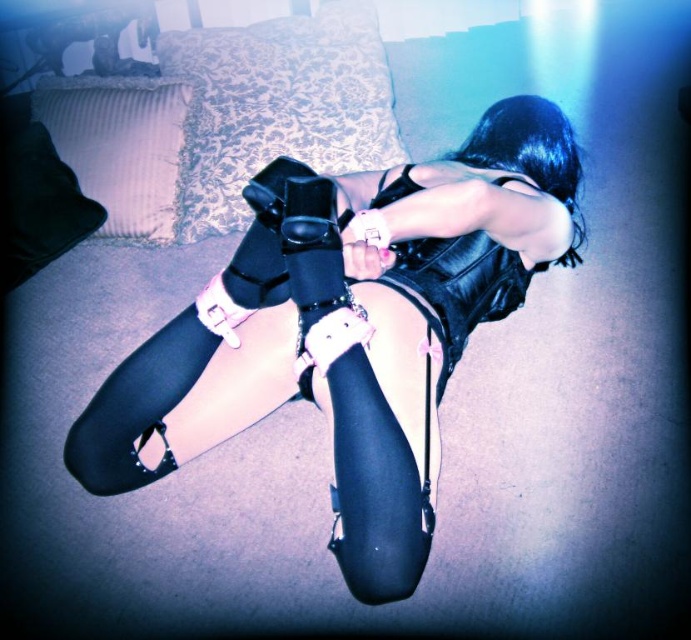
You are a photographer setting up equipment in the room. You need to place a tripod between the black leather gloves at center and the white fabric pillow at upper left. Since the tripod requires a flat surface, will the height difference between the two objects cause any issue?

The black leather gloves at center has a greater height compared to white fabric pillow at upper left, so placing the tripod between them may result in an uneven surface. This could affect the stability of the tripod, so it is advisable to level the area or choose a flatter spot.